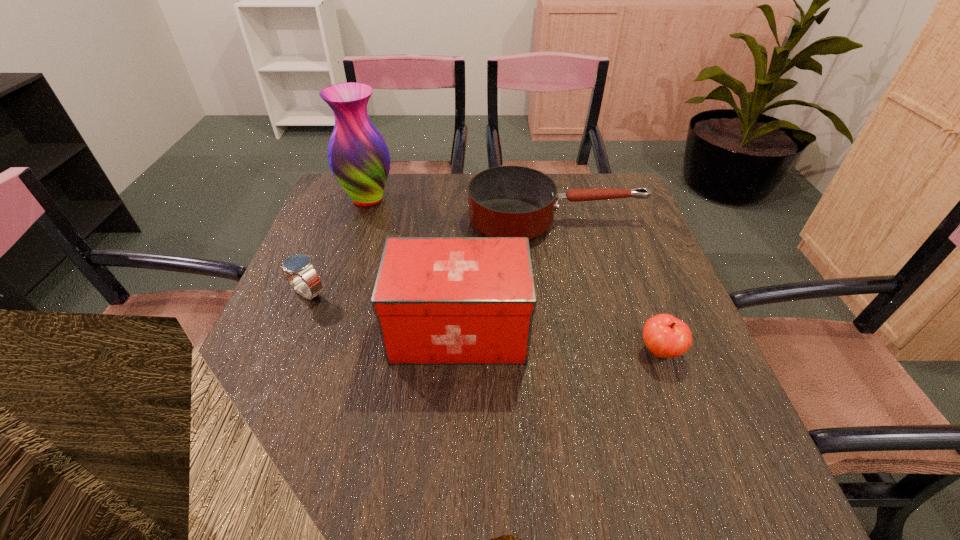
This screenshot has width=960, height=540. What are the coordinates of `free point that satisfies the following two spatial constraints: 1. on the handle side of the apple; 2. on the left side of the pan` in the screenshot? It's located at (585, 352).

Locate an element on the screen. vacant space that satisfies the following two spatial constraints: 1. on the handle side of the fourth shortest object; 2. on the left side of the apple is located at coordinates (458, 352).

Locate an element on the screen. The height and width of the screenshot is (540, 960). vacant area in the image that satisfies the following two spatial constraints: 1. on the handle side of the apple; 2. on the left side of the second tallest object is located at coordinates (458, 352).

Image resolution: width=960 pixels, height=540 pixels. In order to click on free space that satisfies the following two spatial constraints: 1. on the handle side of the first-aid kit; 2. on the back side of the apple in this screenshot , I will do `click(458, 352)`.

This screenshot has width=960, height=540. I want to click on vacant space that satisfies the following two spatial constraints: 1. on the handle side of the pan; 2. on the right side of the apple, so click(x=585, y=352).

The height and width of the screenshot is (540, 960). I want to click on free location that satisfies the following two spatial constraints: 1. on the handle side of the pan; 2. on the back side of the apple, so click(x=585, y=352).

Locate an element on the screen. vacant region that satisfies the following two spatial constraints: 1. on the front side of the apple; 2. on the left side of the watch is located at coordinates (284, 352).